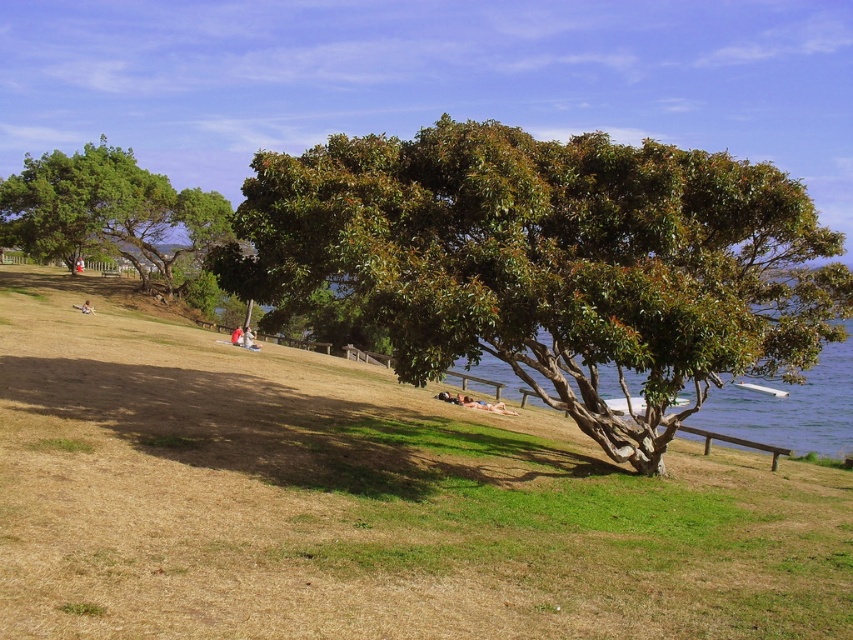
Does green glossy tree at center have a greater height compared to clear blue water at lower right?

Yes.

Is green glossy tree at center positioned behind clear blue water at lower right?

No.

The height and width of the screenshot is (640, 853). Identify the location of green glossy tree at center. (552, 262).

Can you confirm if green leafy tree at upper left is wider than clear blue water at lower right?

Correct, the width of green leafy tree at upper left exceeds that of clear blue water at lower right.

Which is above, green leafy tree at upper left or clear blue water at lower right?

green leafy tree at upper left is above.

Between point (45, 164) and point (769, 442), which one is positioned behind?

The point (45, 164) is behind.

Locate an element on the screen. The image size is (853, 640). green leafy tree at upper left is located at coordinates (85, 204).

Measure the distance between green glossy tree at center and green leafy tree at upper left.

green glossy tree at center is 32.85 meters away from green leafy tree at upper left.

Which is more to the left, green glossy tree at center or green leafy tree at upper left?

green leafy tree at upper left is more to the left.

Between point (682, 348) and point (44, 220), which one is positioned behind?

The point (44, 220) is behind.

Where is `green glossy tree at center`? green glossy tree at center is located at coordinates (552, 262).